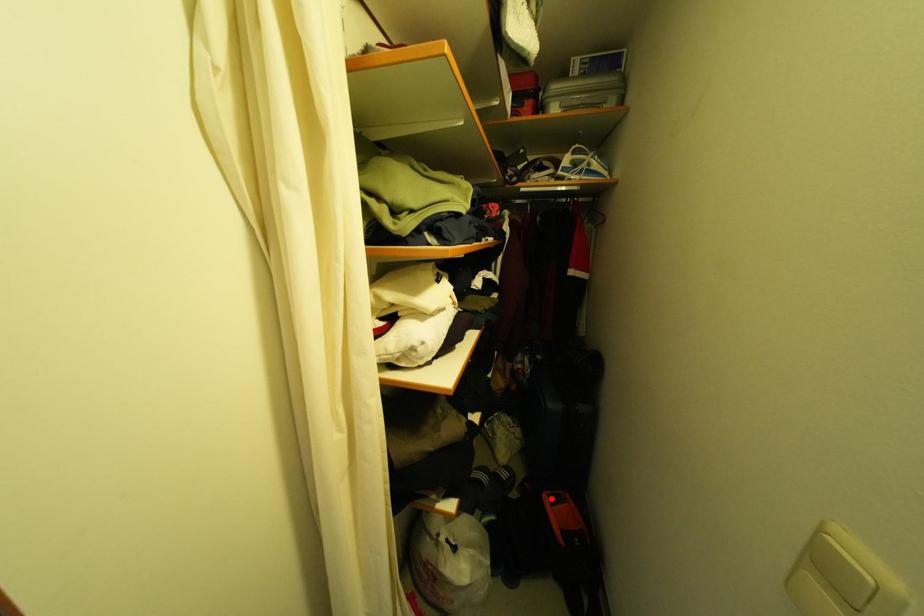
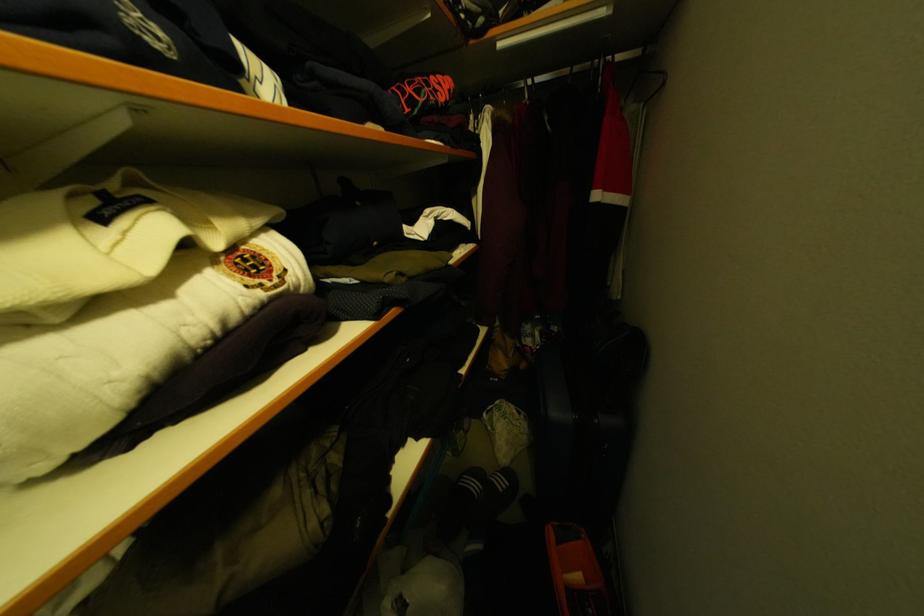
The point at the highlighted location is marked in the first image. Where is the corresponding point in the second image?

(555, 533)